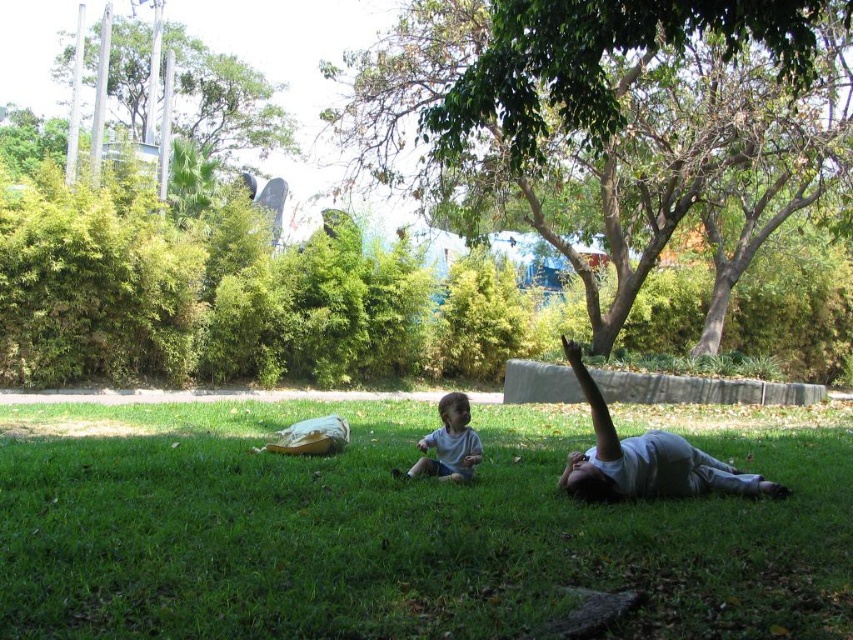
Question: Based on their relative distances, which object is farther from the green grass at center?

Choices:
 (A) green leafy tree at upper center
 (B) green leafy tree at upper left
 (C) white cotton shirt at center

Answer: (B)

Question: Does green leafy tree at upper center have a greater width compared to white cotton shirt at lower right?

Choices:
 (A) yes
 (B) no

Answer: (A)

Question: Is green leafy tree at upper left closer to the viewer compared to white cotton shirt at lower right?

Choices:
 (A) no
 (B) yes

Answer: (A)

Question: Which point appears farthest from the camera in this image?

Choices:
 (A) (404, 128)
 (B) (236, 525)
 (C) (265, 128)

Answer: (C)

Question: Which object is positioned closest to the green grass at center?

Choices:
 (A) white cotton shirt at center
 (B) white cotton shirt at lower right
 (C) green leafy tree at upper left
 (D) green leafy tree at upper center

Answer: (B)

Question: Does green leafy tree at upper center appear on the right side of white cotton shirt at center?

Choices:
 (A) yes
 (B) no

Answer: (A)